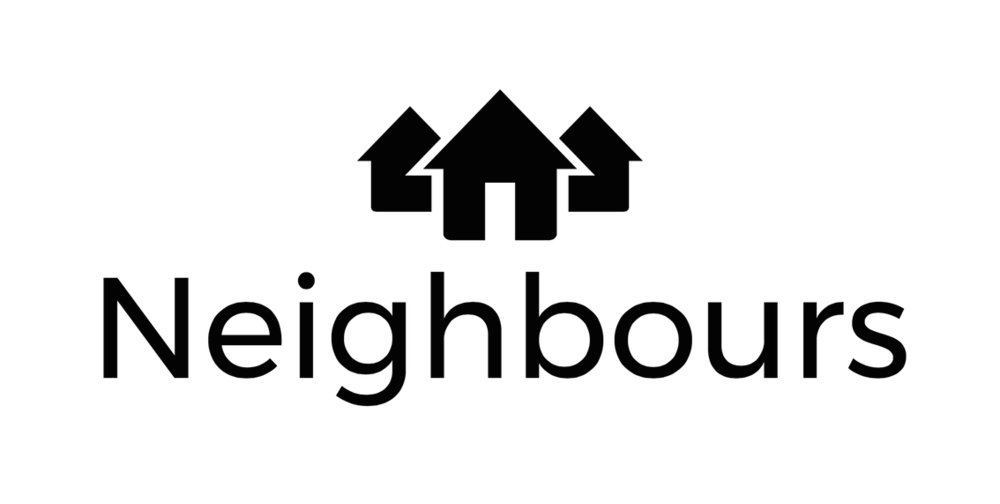
Image resolution: width=1000 pixels, height=504 pixels. What are the coordinates of `door` in the screenshot? It's located at (502, 219).